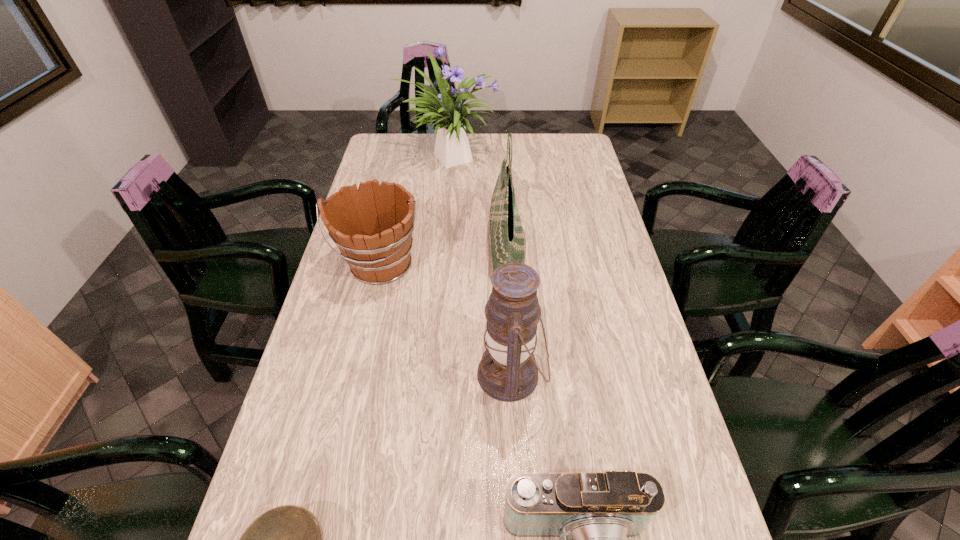
The image size is (960, 540). In order to click on wine bucket positioned at the left edge in this screenshot , I will do `click(372, 226)`.

Identify the location of object that is positioned at the far left corner. (452, 148).

Image resolution: width=960 pixels, height=540 pixels. In the image, there is a desktop. Identify the location of free space at the left edge. (327, 302).

Locate an element on the screen. vacant space at the right edge of the desktop is located at coordinates (609, 301).

This screenshot has width=960, height=540. In order to click on vacant space at the far left corner in this screenshot , I will do `click(384, 157)`.

The image size is (960, 540). In the image, there is a desktop. What are the coordinates of `vacant space at the far right corner` in the screenshot? It's located at (551, 136).

I want to click on vacant area that lies between the third nearest object and the farthest object, so (x=479, y=265).

Find the location of `empty space between the farthest object and the oil lamp`. empty space between the farthest object and the oil lamp is located at coordinates (479, 265).

Identify which object is the closest to the tote bag. Please provide its 2D coordinates. Your answer should be formatted as a tuple, i.e. [(x, y)], where the tuple contains the x and y coordinates of a point satisfying the conditions above.

[(507, 372)]

The image size is (960, 540). Identify the location of object that is the third closest to the third nearest object. (372, 226).